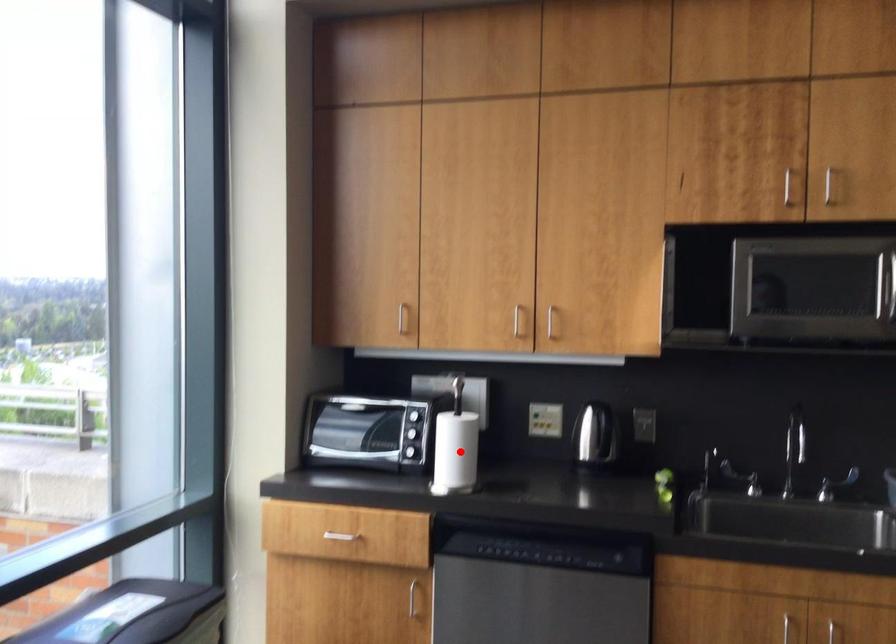
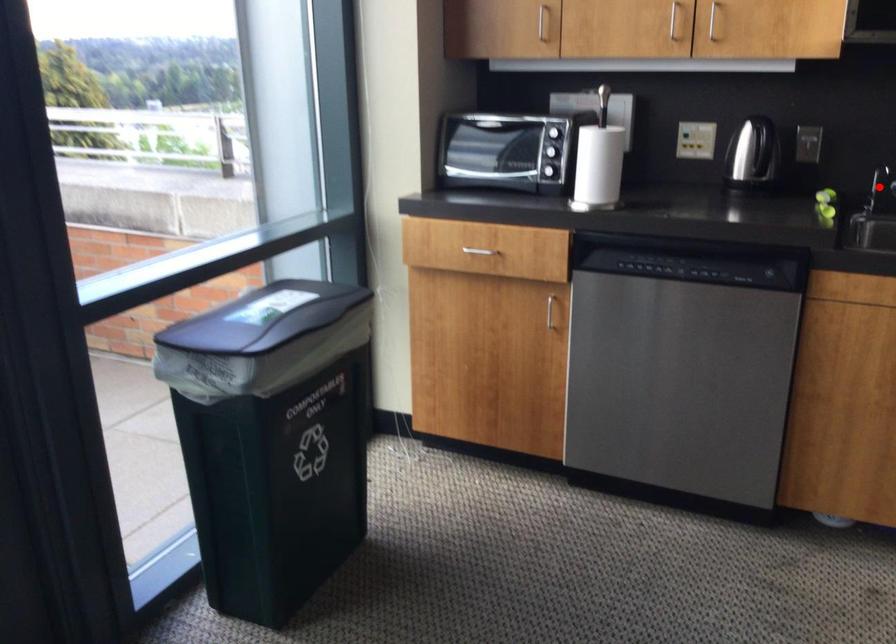
I am providing you with two images of the same scene from different viewpoints. A red point is marked on the first image and another point is marked on the second image. Are the points marked in image1 and image2 representing the same 3D position?

No